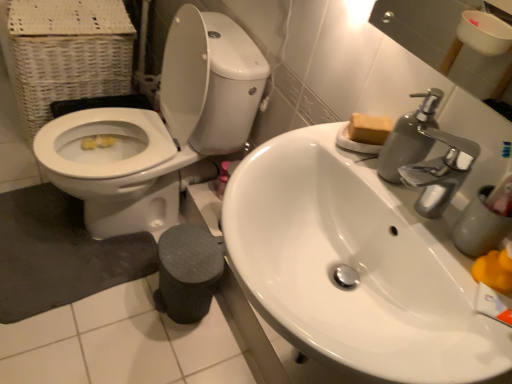
Question: Is yellow plastic toy at sink right situated inside white glossy toilet at left or outside?

Choices:
 (A) outside
 (B) inside

Answer: (A)

Question: Is point (485, 195) positioned closer to the camera than point (241, 130)?

Choices:
 (A) farther
 (B) closer

Answer: (B)

Question: Which is farther from the yellow plastic toy at sink right?

Choices:
 (A) metallic gray soap dispenser at upper right
 (B) white glossy toilet at left
 (C) silver metallic faucet at upper right
 (D) brown matte soap at upper right
 (E) dark gray textured bath mat at lower left

Answer: (E)

Question: Estimate the real-world distances between objects in this image. Which object is farther from the dark gray textured bath mat at lower left?

Choices:
 (A) white glossy sink at upper right
 (B) white wicker basket at left
 (C) white glossy toilet at left
 (D) brown matte soap at upper right
 (E) silver metallic faucet at upper right

Answer: (E)